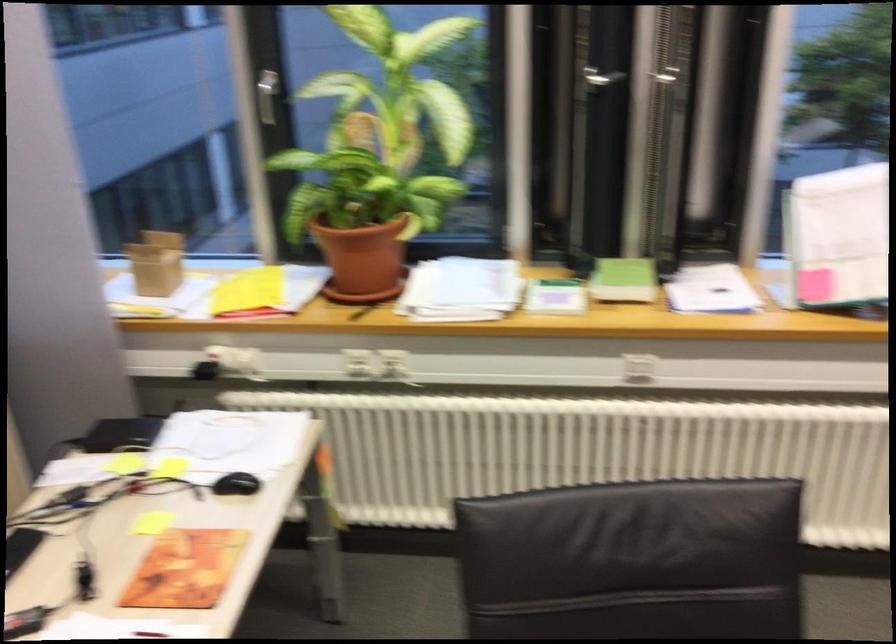
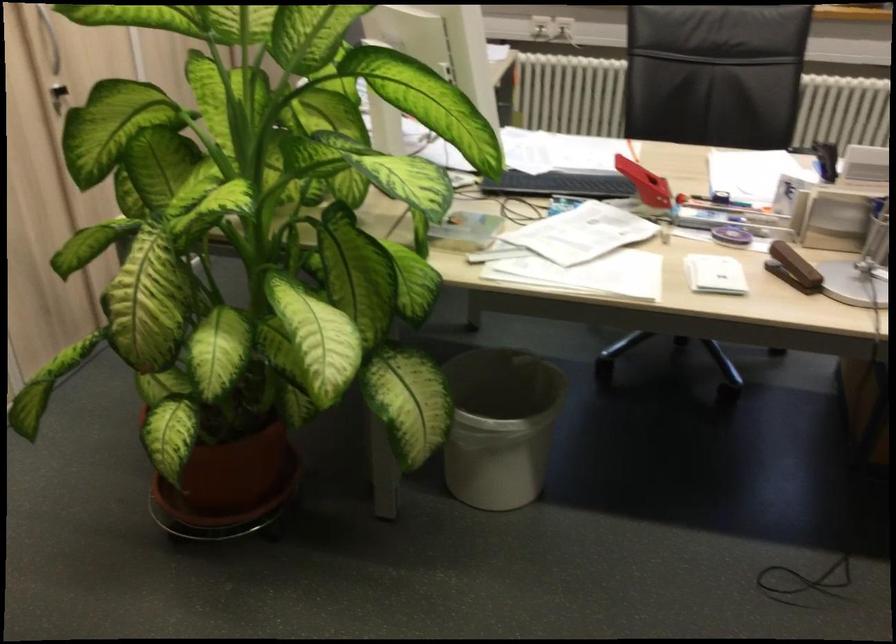
Question: I am providing you with two images of the same scene from different viewpoints. Please identify which objects are invisible in image2.

Choices:
 (A) black cabinet handle
 (B) orange book
 (C) grey printer button
 (D) red stapler

Answer: (B)